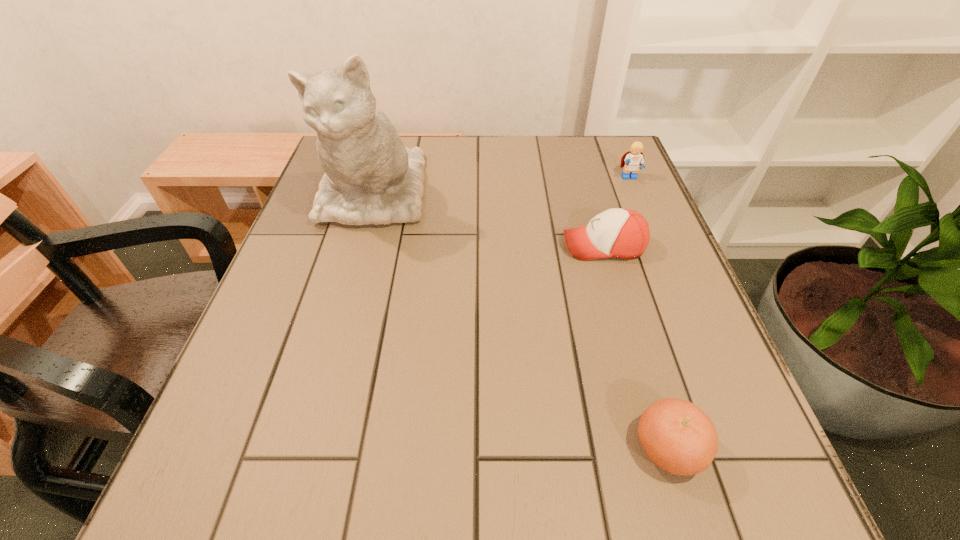
At what (x,y) coordinates should I click in order to perform the action: click on cat. Please return your answer as a coordinate pair (x, y). The image size is (960, 540). Looking at the image, I should click on (370, 177).

Where is `the leftmost object`? This screenshot has height=540, width=960. the leftmost object is located at coordinates (370, 177).

Find the location of a particular element. This screenshot has width=960, height=540. Lego is located at coordinates (633, 160).

Find the location of `baseball cap`. baseball cap is located at coordinates (621, 233).

Locate an element on the screen. the nearest object is located at coordinates point(677,436).

Locate an element on the screen. This screenshot has height=540, width=960. free location located on the front-facing side of the tallest object is located at coordinates (338, 318).

The height and width of the screenshot is (540, 960). Find the location of `vacant space situated on the front-facing side of the Lego`. vacant space situated on the front-facing side of the Lego is located at coordinates (650, 227).

Image resolution: width=960 pixels, height=540 pixels. I want to click on free space located on the front-facing side of the baseball cap, so click(512, 246).

Identify the location of free space located on the front-facing side of the baseball cap. (448, 246).

Find the location of a particular element. vacant space located 0.260m on the front-facing side of the baseball cap is located at coordinates (444, 246).